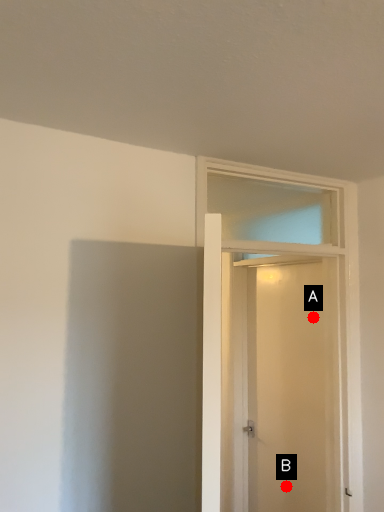
Question: Two points are circled on the image, labeled by A and B beside each circle. Which of the following is the closest to the observer?

Choices:
 (A) A is closer
 (B) B is closer

Answer: (A)